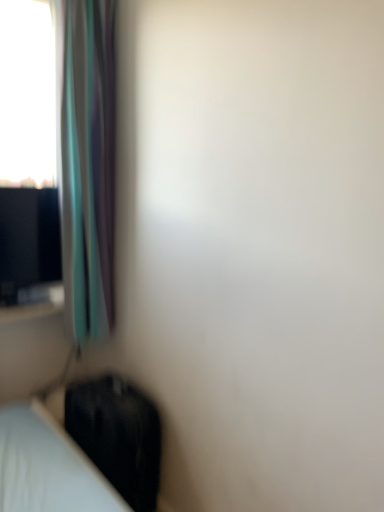
The height and width of the screenshot is (512, 384). What do you see at coordinates (88, 167) in the screenshot?
I see `translucent fabric curtain at left` at bounding box center [88, 167].

At what (x,y) coordinates should I click in order to perform the action: click on translucent fabric curtain at left. Please return your answer as a coordinate pair (x, y). Looking at the image, I should click on (88, 167).

What do you see at coordinates (118, 435) in the screenshot? I see `black fabric luggage at lower left` at bounding box center [118, 435].

In order to face black fabric luggage at lower left, should I rotate leftwards or rightwards?

It's best to rotate left around 10.949 degrees.

The height and width of the screenshot is (512, 384). What are the coordinates of `black fabric luggage at lower left` in the screenshot? It's located at (118, 435).

You are a GUI agent. You are given a task and a screenshot of the screen. Output one action in this format:
    pyautogui.click(x=<x>, y=<y>)
    Task: Click on the translucent fabric curtain at left
    
    Given the screenshot: What is the action you would take?
    pyautogui.click(x=88, y=167)

From the picture: Can you confirm if translucent fabric curtain at left is positioned to the right of black fabric luggage at lower left?

No.

Which object is closer to the camera, translucent fabric curtain at left or black fabric luggage at lower left?

translucent fabric curtain at left is in front.

Considering the positions of points (98, 94) and (91, 459), is point (98, 94) farther from camera compared to point (91, 459)?

Yes, point (98, 94) is farther from viewer.

From the image's perspective, is translucent fabric curtain at left under black fabric luggage at lower left?

Actually, translucent fabric curtain at left appears above black fabric luggage at lower left in the image.

From a real-world perspective, does translucent fabric curtain at left sit lower than black fabric luggage at lower left?

No.

Which of these two, translucent fabric curtain at left or black fabric luggage at lower left, is wider?

Wider between the two is black fabric luggage at lower left.

Who is shorter, translucent fabric curtain at left or black fabric luggage at lower left?

With less height is black fabric luggage at lower left.

Considering the sizes of objects translucent fabric curtain at left and black fabric luggage at lower left in the image provided, who is smaller, translucent fabric curtain at left or black fabric luggage at lower left?

black fabric luggage at lower left.

Can we say translucent fabric curtain at left lies outside black fabric luggage at lower left?

Indeed, translucent fabric curtain at left is completely outside black fabric luggage at lower left.

Are translucent fabric curtain at left and black fabric luggage at lower left far apart?

That's not correct — translucent fabric curtain at left is a little close to black fabric luggage at lower left.

Is translucent fabric curtain at left positioned with its back to black fabric luggage at lower left?

No, translucent fabric curtain at left is not facing the opposite direction of black fabric luggage at lower left.

How different are the orientations of translucent fabric curtain at left and black fabric luggage at lower left in degrees?

They differ by 0.609 degrees in their facing directions.

This screenshot has height=512, width=384. What are the coordinates of `curtain to the left of black fabric luggage at lower left` in the screenshot? It's located at (88, 167).

Which is more to the right, black fabric luggage at lower left or translucent fabric curtain at left?

Positioned to the right is black fabric luggage at lower left.

Is black fabric luggage at lower left in front of or behind translucent fabric curtain at left in the image?

Clearly, black fabric luggage at lower left is behind translucent fabric curtain at left.

Is point (146, 432) farther from viewer compared to point (113, 21)?

Yes, point (146, 432) is behind point (113, 21).

From the image's perspective, does black fabric luggage at lower left appear higher than translucent fabric curtain at left?

No.

From a real-world perspective, who is located higher, black fabric luggage at lower left or translucent fabric curtain at left?

translucent fabric curtain at left, from a real-world perspective.

Considering the sizes of objects black fabric luggage at lower left and translucent fabric curtain at left in the image provided, who is wider, black fabric luggage at lower left or translucent fabric curtain at left?

black fabric luggage at lower left is wider.

Which of these two, black fabric luggage at lower left or translucent fabric curtain at left, stands taller?

Standing taller between the two is translucent fabric curtain at left.

Which of these two, black fabric luggage at lower left or translucent fabric curtain at left, is bigger?

translucent fabric curtain at left.

Would you say black fabric luggage at lower left is inside or outside translucent fabric curtain at left?

black fabric luggage at lower left is not enclosed by translucent fabric curtain at left.

Is black fabric luggage at lower left positioned far away from translucent fabric curtain at left?

No.

Is black fabric luggage at lower left looking in the opposite direction of translucent fabric curtain at left?

No, translucent fabric curtain at left is not at the back of black fabric luggage at lower left.

Consider the image. How many degrees apart are the facing directions of black fabric luggage at lower left and translucent fabric curtain at left?

They differ by 0.609 degrees in their facing directions.

The image size is (384, 512). I want to click on curtain lying in front of the black fabric luggage at lower left, so click(88, 167).

Locate an element on the screen. luggage below the translucent fabric curtain at left (from the image's perspective) is located at coordinates (118, 435).

Identify the location of curtain that is above the black fabric luggage at lower left (from a real-world perspective). (88, 167).